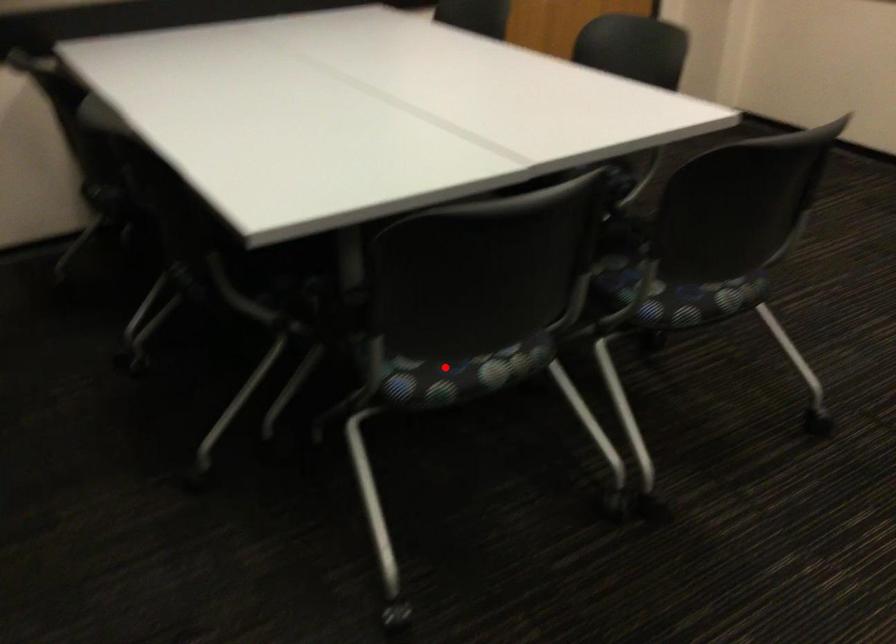
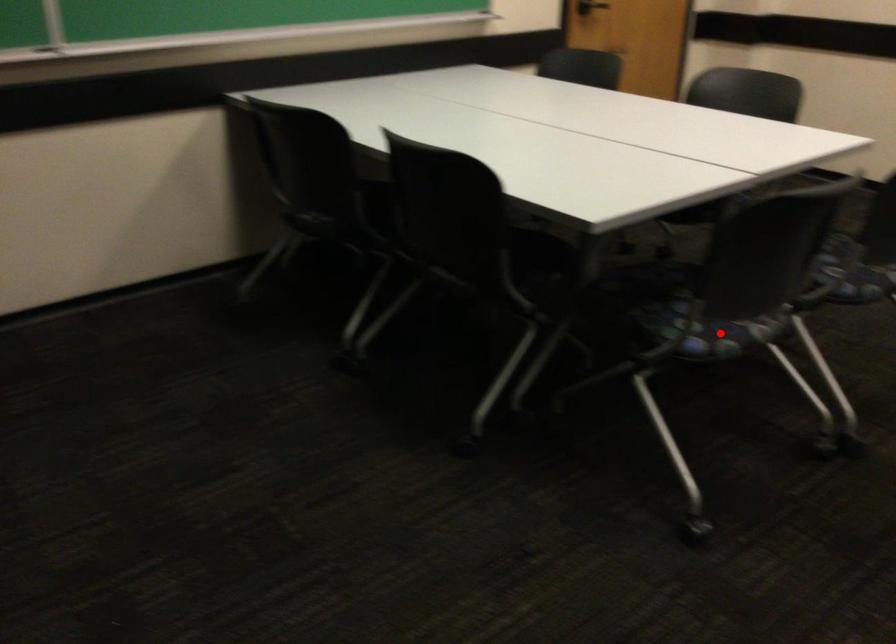
I am providing you with two images of the same scene from different viewpoints. A red point is marked on the first image and another point is marked on the second image. Is the red point in image1 aligned with the point shown in image2?

Yes